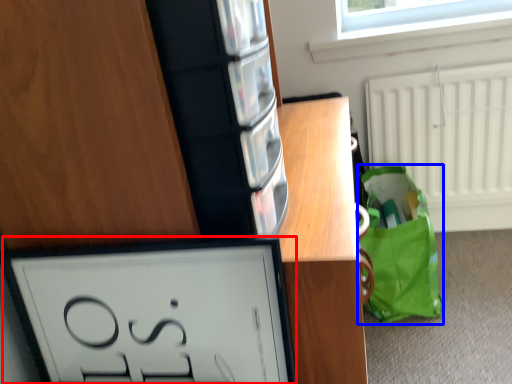
Question: Which of the following is the closest to the observer, picture frame (highlighted by a red box) or tote bag (highlighted by a blue box)?

Choices:
 (A) picture frame
 (B) tote bag

Answer: (A)